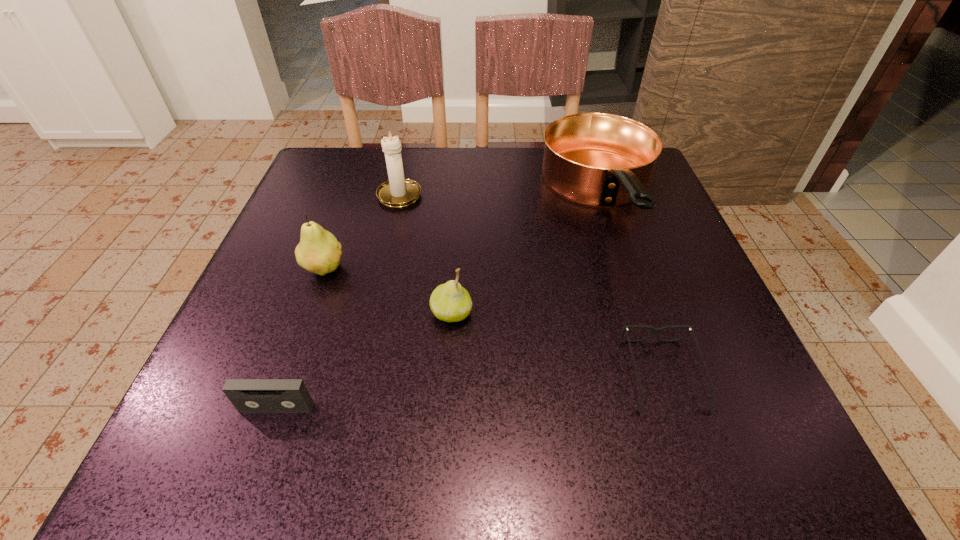
Locate an element on the screen. The width and height of the screenshot is (960, 540). free spot between the frying pan and the farther pear is located at coordinates (464, 235).

This screenshot has height=540, width=960. I want to click on vacant area that lies between the left pear and the shortest object, so click(493, 322).

At what (x,y) coordinates should I click in order to perform the action: click on vacant point located between the spectacles and the left pear. Please return your answer as a coordinate pair (x, y). Looking at the image, I should click on (493, 322).

Choose which object is the third nearest neighbor to the second shortest object. Please provide its 2D coordinates. Your answer should be formatted as a tuple, i.e. [(x, y)], where the tuple contains the x and y coordinates of a point satisfying the conditions above.

[(654, 330)]

At what (x,y) coordinates should I click in order to perform the action: click on the closest object to the frying pan. Please return your answer as a coordinate pair (x, y). The width and height of the screenshot is (960, 540). Looking at the image, I should click on click(x=654, y=330).